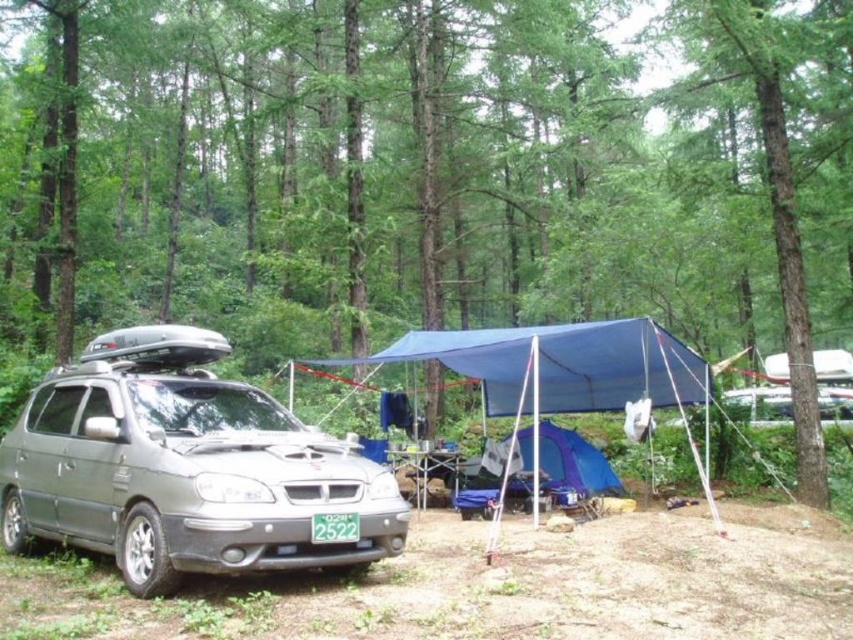
You are standing at the point labeled point (21, 481) and want to walk to the point labeled point (454, 371). According to the image, will you be moving towards the car or away from it?

Since point (21, 481) is in front of point (454, 371), moving from point (21, 481) to point (454, 371) would mean moving away from the car parked in the foreground.

You are a photographer standing in front of the silver metallic minivan at center. You want to capture a photo of the minivan without any obstructions. Given that your camera lens has a minimum focusing distance of 3 meters, will you be able to take the photo clearly?

The silver metallic minivan at center is 3.62 meters from camera. Since the minimum focusing distance is 3 meters, the photographer can take a clear photo as the distance is within the camera lens capability.

You are a hiker who needs to carry a 3.5 meter long ladder from the silver metallic minivan at center to the blue fabric tent at center. Considering the space between them, will the ladder fit through without bending or breaking?

The distance between the silver metallic minivan at center and the blue fabric tent at center is 2.72 meters. Since the ladder is 3.5 meters long, it will not fit through the space between them without bending or breaking.